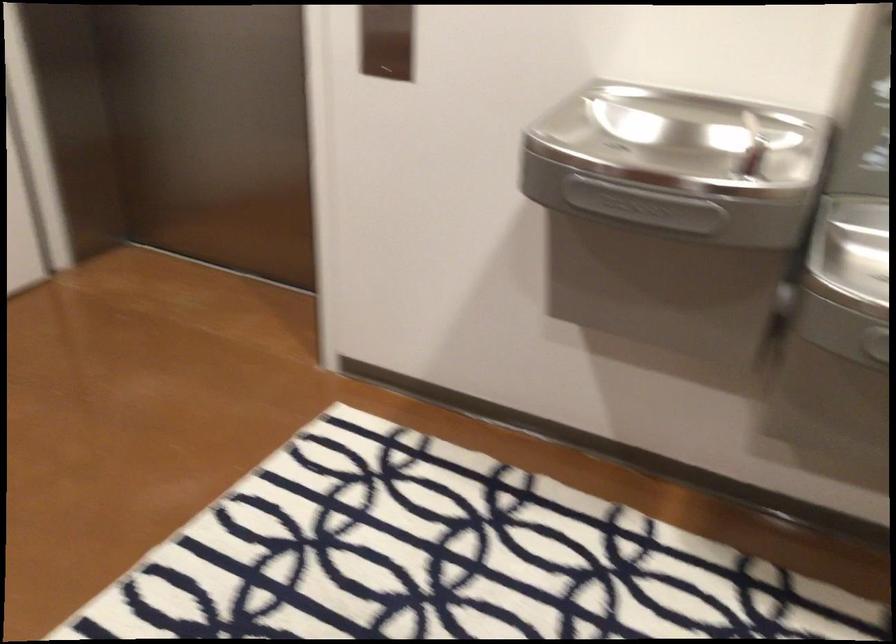
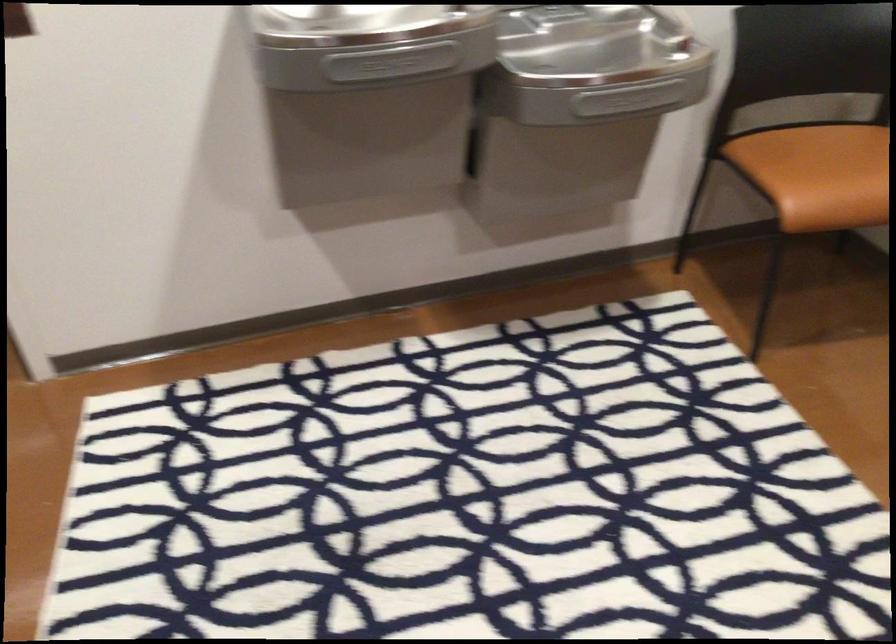
The point at (x=651, y=207) is marked in the first image. Where is the corresponding point in the second image?

(391, 62)